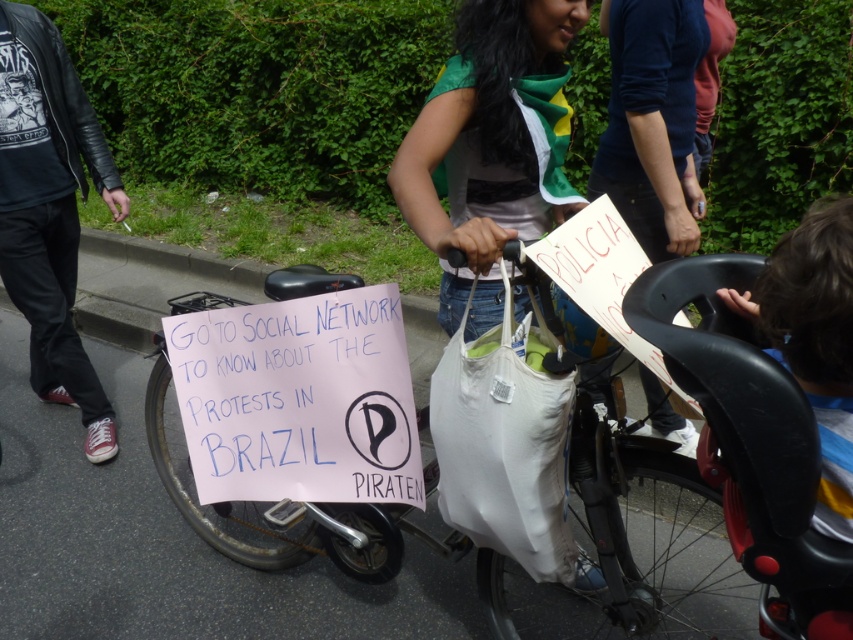
You are a photographer who wants to capture the protest scene. You notice the black leather jacket at left and the white fabric bag at center. Which object is positioned higher in the image?

The black leather jacket at left is above the white fabric bag at center, so it is positioned higher in the image.

You are a photographer standing at the edge of the protest. You want to take a photo that includes both the pink paper sign at center and the white plastic bag hanging from the handlebars. What is the minimum distance you need to move backward to ensure both objects are in frame?

The minimum distance you need to move backward is 5.05 feet to ensure both the pink paper sign at center and the white plastic bag hanging from the handlebars are in frame.